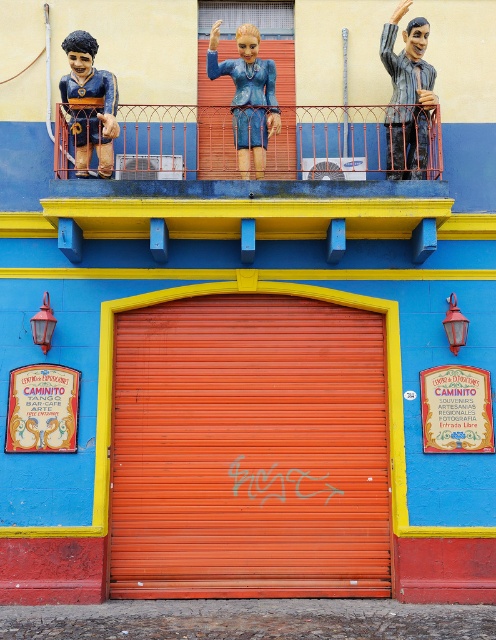
Is orange matte garage door at center above matte blue plastic boy at upper left?

Actually, orange matte garage door at center is below matte blue plastic boy at upper left.

Measure the distance between orange matte garage door at center and matte blue plastic boy at upper left.

2.17 meters

What do you see at coordinates (248, 449) in the screenshot? I see `orange matte garage door at center` at bounding box center [248, 449].

This screenshot has width=496, height=640. Identify the location of orange matte garage door at center. (248, 449).

Does metallic red railing at upper center have a greater height compared to matte blue figure at center?

No.

Does metallic red railing at upper center have a larger size compared to matte blue figure at center?

Yes, metallic red railing at upper center is bigger than matte blue figure at center.

Locate an element on the screen. The width and height of the screenshot is (496, 640). metallic red railing at upper center is located at coordinates (251, 156).

Can you confirm if matte blue figure at center is wider than matte blue plastic boy at upper left?

Yes, matte blue figure at center is wider than matte blue plastic boy at upper left.

Is matte blue figure at center thinner than matte blue plastic boy at upper left?

In fact, matte blue figure at center might be wider than matte blue plastic boy at upper left.

Find the location of `matte blue figure at center`. matte blue figure at center is located at coordinates (248, 96).